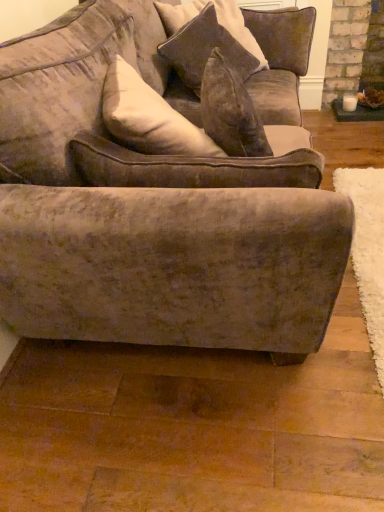
Question: Does velvet brown couch at center have a smaller size compared to velvet cushion at upper center?

Choices:
 (A) no
 (B) yes

Answer: (A)

Question: Is velvet brown couch at center further to the viewer compared to velvet cushion at upper center?

Choices:
 (A) yes
 (B) no

Answer: (B)

Question: From the image's perspective, is velvet brown couch at center beneath velvet cushion at upper center?

Choices:
 (A) no
 (B) yes

Answer: (B)

Question: Considering the relative sizes of velvet brown couch at center and velvet cushion at upper center in the image provided, is velvet brown couch at center thinner than velvet cushion at upper center?

Choices:
 (A) yes
 (B) no

Answer: (B)

Question: Is velvet brown couch at center in contact with velvet cushion at upper center?

Choices:
 (A) yes
 (B) no

Answer: (B)

Question: From the image's perspective, relative to velvet cushion at upper center, is velvet brown couch at center above or below?

Choices:
 (A) below
 (B) above

Answer: (A)

Question: In the image, is velvet brown couch at center positioned in front of or behind velvet cushion at upper center?

Choices:
 (A) behind
 (B) front

Answer: (B)

Question: In terms of width, does velvet brown couch at center look wider or thinner when compared to velvet cushion at upper center?

Choices:
 (A) thin
 (B) wide

Answer: (B)

Question: Is velvet brown couch at center taller or shorter than velvet cushion at upper center?

Choices:
 (A) short
 (B) tall

Answer: (B)

Question: Relative to velvet brown couch at center, is velvet cushion at upper center in front or behind?

Choices:
 (A) behind
 (B) front

Answer: (A)

Question: From the image's perspective, is velvet cushion at upper center positioned above or below velvet brown couch at center?

Choices:
 (A) above
 (B) below

Answer: (A)

Question: Considering the positions of point (215, 41) and point (230, 263), is point (215, 41) closer or farther from the camera than point (230, 263)?

Choices:
 (A) farther
 (B) closer

Answer: (A)

Question: Based on their positions, is velvet cushion at upper center located to the left or right of velvet brown couch at center?

Choices:
 (A) right
 (B) left

Answer: (A)

Question: Looking at their shapes, would you say velvet cushion at upper center is wider or thinner than velvet brown couch at center?

Choices:
 (A) thin
 (B) wide

Answer: (A)

Question: Is velvet cushion at upper center situated inside velvet brown couch at center or outside?

Choices:
 (A) outside
 (B) inside

Answer: (A)